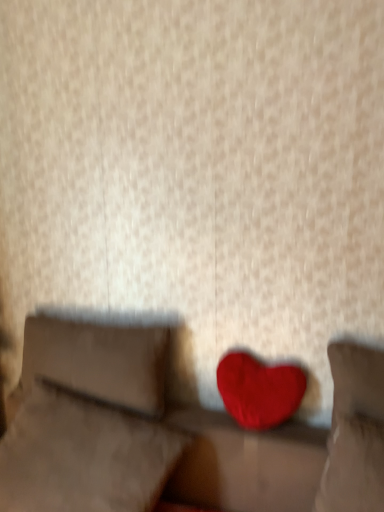
Question: Is matte red heart at center in front of or behind velvet red heart at center, which appears as the 1th pillow when viewed from the right, in the image?

Choices:
 (A) behind
 (B) front

Answer: (A)

Question: Considering the positions of matte red heart at center and velvet red heart at center, which appears as the 1th pillow when viewed from the right, in the image, is matte red heart at center taller or shorter than velvet red heart at center, which appears as the 1th pillow when viewed from the right,?

Choices:
 (A) tall
 (B) short

Answer: (B)

Question: Based on their relative distances, which object is nearer to the velvet red heart at center, which appears as the 1th pillow when viewed from the right?

Choices:
 (A) velvet red heart at center, arranged as the second pillow when viewed from the left
 (B) matte red heart at center
 (C) suede-like beige pillow at left, the 1th pillow when ordered from left to right
 (D) velvet red heart at center

Answer: (B)

Question: Based on their relative distances, which object is nearer to the velvet red heart at center?

Choices:
 (A) suede-like beige pillow at left, the third pillow positioned from the right
 (B) velvet red heart at center, which ranks as the third pillow in left-to-right order
 (C) velvet red heart at center, arranged as the second pillow when viewed from the left
 (D) matte red heart at center

Answer: (C)